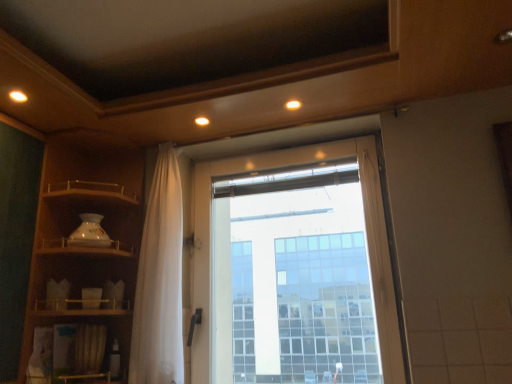
What do you see at coordinates (367, 230) in the screenshot? This screenshot has height=384, width=512. I see `transparent glass window at center` at bounding box center [367, 230].

You are a GUI agent. You are given a task and a screenshot of the screen. Output one action in this format:
    pyautogui.click(x=<x>, y=<y>)
    Task: Click on the matte wood shelf at left
    The image size is (512, 384).
    Given the screenshot: What is the action you would take?
    79,224

Considering the positions of point (205, 221) and point (161, 219), is point (205, 221) closer or farther from the camera than point (161, 219)?

Point (205, 221).

Is transparent glass window at center inside the boundaries of white sheer curtain at center, or outside?

The correct answer is: outside.

Is transparent glass window at center smaller than white sheer curtain at center?

Incorrect, transparent glass window at center is not smaller in size than white sheer curtain at center.

Is matte wood shelf at left positioned far away from transparent glass window at center?

No, matte wood shelf at left is not far from transparent glass window at center.

Does matte wood shelf at left turn towards transparent glass window at center?

Yes, matte wood shelf at left is turned towards transparent glass window at center.

Which of these two, matte wood shelf at left or transparent glass window at center, is thinner?

transparent glass window at center.

This screenshot has width=512, height=384. I want to click on shelf that appears on the left of transparent glass window at center, so click(x=79, y=224).

Does point (399, 367) come farther from viewer compared to point (68, 206)?

No, it is in front of (68, 206).

Is transparent glass window at center surrounding matte wood shelf at left?

Definitely not — matte wood shelf at left is not inside transparent glass window at center.

From a real-world perspective, is transparent glass window at center positioned above or below matte wood shelf at left?

In terms of real-world spatial position, transparent glass window at center is below matte wood shelf at left.

What's the angular difference between white sheer curtain at center and matte wood shelf at left's facing directions?

They differ by 94.6 degrees in their facing directions.

Is white sheer curtain at center not near matte wood shelf at left?

No.

Is matte wood shelf at left a part of white sheer curtain at center?

Actually, matte wood shelf at left is outside white sheer curtain at center.

How much distance is there between white sheer curtain at center and matte wood shelf at left?

They are 8.55 inches apart.

This screenshot has height=384, width=512. Identify the location of shower curtain that appears above the transparent glass window at center (from a real-world perspective). (160, 281).

Does white sheer curtain at center touch transparent glass window at center?

white sheer curtain at center and transparent glass window at center are not in contact.

Based on the photo, from the image's perspective, which one is positioned higher, white sheer curtain at center or transparent glass window at center?

white sheer curtain at center is shown above in the image.

In the scene shown: Could you tell me if white sheer curtain at center is facing transparent glass window at center?

No, white sheer curtain at center does not turn towards transparent glass window at center.

Is matte wood shelf at left beside white sheer curtain at center?

No, matte wood shelf at left is not touching white sheer curtain at center.

Between matte wood shelf at left and white sheer curtain at center, which one has larger size?

With larger size is matte wood shelf at left.

Is matte wood shelf at left oriented away from white sheer curtain at center?

Yes, white sheer curtain at center is at the back of matte wood shelf at left.

Is matte wood shelf at left not inside white sheer curtain at center?

matte wood shelf at left lies outside white sheer curtain at center's area.

The image size is (512, 384). In order to click on shower curtain located on the left of transparent glass window at center in this screenshot , I will do `click(160, 281)`.

The width and height of the screenshot is (512, 384). Find the location of `window that is below the matte wood shelf at left (from the image's perspective)`. window that is below the matte wood shelf at left (from the image's perspective) is located at coordinates [x=367, y=230].

Based on their spatial positions, is matte wood shelf at left or transparent glass window at center further from white sheer curtain at center?

transparent glass window at center is positioned further to the anchor white sheer curtain at center.

Estimate the real-world distances between objects in this image. Which object is further from transparent glass window at center, matte wood shelf at left or white sheer curtain at center?

Among the two, matte wood shelf at left is located further to transparent glass window at center.

Based on their spatial positions, is transparent glass window at center or white sheer curtain at center further from matte wood shelf at left?

Among the two, transparent glass window at center is located further to matte wood shelf at left.

Which object lies further to the anchor point white sheer curtain at center, transparent glass window at center or matte wood shelf at left?

transparent glass window at center is further to white sheer curtain at center.

Estimate the real-world distances between objects in this image. Which object is closer to transparent glass window at center, white sheer curtain at center or matte wood shelf at left?

Based on the image, white sheer curtain at center appears to be nearer to transparent glass window at center.

Which object lies nearer to the anchor point matte wood shelf at left, white sheer curtain at center or transparent glass window at center?

white sheer curtain at center lies closer to matte wood shelf at left than the other object.

Locate an element on the screen. The height and width of the screenshot is (384, 512). shower curtain located between matte wood shelf at left and transparent glass window at center in the left-right direction is located at coordinates (160, 281).